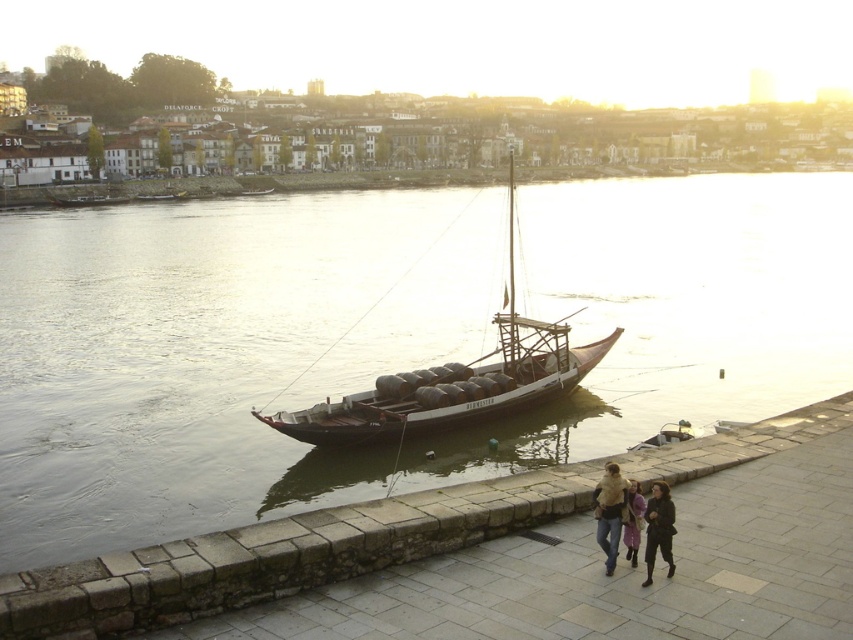
You are a traveler standing at the riverside and you see two jackets, a brown leather jacket at lower center and a dark brown leather jacket at lower right. Which jacket is bigger in size?

The brown leather jacket at lower center is larger in size compared to the dark brown leather jacket at lower right.

You are a tourist visiting the riverside and want to take a photo of the smooth stone walkway at lower center and the dark brown leather jacket at lower right. Which object will appear larger in your photo?

The smooth stone walkway at lower center will appear larger in the photo because it is bigger than the dark brown leather jacket at lower right.